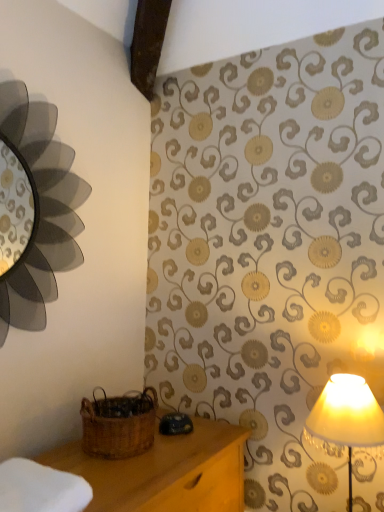
The image size is (384, 512). What do you see at coordinates (41, 488) in the screenshot? I see `white soft cloth at lower left` at bounding box center [41, 488].

The image size is (384, 512). Identify the location of woven brown basket at lower left. (119, 424).

Where is `matte cream lampshade at right`? This screenshot has width=384, height=512. matte cream lampshade at right is located at coordinates (346, 420).

Find the location of a particular element. This screenshot has height=512, width=384. white soft cloth at lower left is located at coordinates (41, 488).

Is white soft cloth at lower left smaller than woven brown basket at lower left?

Yes, white soft cloth at lower left is smaller than woven brown basket at lower left.

Can you see white soft cloth at lower left touching woven brown basket at lower left?

No, white soft cloth at lower left is not touching woven brown basket at lower left.

In the scene shown: From the image's perspective, is white soft cloth at lower left under woven brown basket at lower left?

Correct, white soft cloth at lower left appears lower than woven brown basket at lower left in the image.

Who is more distant, white soft cloth at lower left or matte cream lampshade at right?

matte cream lampshade at right.

Consider the image. Is white soft cloth at lower left oriented away from matte cream lampshade at right?

No, white soft cloth at lower left is not facing the opposite direction of matte cream lampshade at right.

The width and height of the screenshot is (384, 512). I want to click on lamp above the white soft cloth at lower left (from a real-world perspective), so click(x=346, y=420).

Between white soft cloth at lower left and matte cream lampshade at right, which one has larger width?

white soft cloth at lower left is wider.

How different are the orientations of matte cream lampshade at right and white soft cloth at lower left in degrees?

The angle between the facing direction of matte cream lampshade at right and the facing direction of white soft cloth at lower left is 86.9 degrees.

Is matte cream lampshade at right wider than white soft cloth at lower left?

No.

Based on the photo, which is more to the left, matte cream lampshade at right or white soft cloth at lower left?

From the viewer's perspective, white soft cloth at lower left appears more on the left side.

Locate an element on the screen. This screenshot has width=384, height=512. cloth that is above the matte cream lampshade at right (from the image's perspective) is located at coordinates (41, 488).

From the picture: Would you consider woven brown basket at lower left to be distant from white soft cloth at lower left?

No, woven brown basket at lower left is not far from white soft cloth at lower left.

Looking at their sizes, would you say woven brown basket at lower left is wider or thinner than white soft cloth at lower left?

Clearly, woven brown basket at lower left has less width compared to white soft cloth at lower left.

From a real-world perspective, is woven brown basket at lower left beneath white soft cloth at lower left?

No, from a real-world perspective, woven brown basket at lower left is not under white soft cloth at lower left.

Can you tell me how much woven brown basket at lower left and white soft cloth at lower left differ in facing direction?

There is a 2.51-degree angle between the facing directions of woven brown basket at lower left and white soft cloth at lower left.

Are matte cream lampshade at right and woven brown basket at lower left far apart?

No.

From the image's perspective, is matte cream lampshade at right located above or below woven brown basket at lower left?

Clearly, from the image's perspective, matte cream lampshade at right is below woven brown basket at lower left.

Could you tell me if matte cream lampshade at right is turned towards woven brown basket at lower left?

No, matte cream lampshade at right is not oriented towards woven brown basket at lower left.

Considering the sizes of objects matte cream lampshade at right and woven brown basket at lower left in the image provided, who is shorter, matte cream lampshade at right or woven brown basket at lower left?

woven brown basket at lower left is shorter.

Considering the relative sizes of woven brown basket at lower left and matte cream lampshade at right in the image provided, is woven brown basket at lower left bigger than matte cream lampshade at right?

Actually, woven brown basket at lower left might be smaller than matte cream lampshade at right.

Between woven brown basket at lower left and matte cream lampshade at right, which one has larger width?

With larger width is woven brown basket at lower left.

From the image's perspective, relative to matte cream lampshade at right, is woven brown basket at lower left above or below?

woven brown basket at lower left is situated higher than matte cream lampshade at right in the image.

Is woven brown basket at lower left situated inside matte cream lampshade at right or outside?

woven brown basket at lower left exists outside the volume of matte cream lampshade at right.

Where is `basket located on the right of white soft cloth at lower left`? This screenshot has height=512, width=384. basket located on the right of white soft cloth at lower left is located at coordinates (119, 424).

The width and height of the screenshot is (384, 512). In order to click on cloth that appears above the matte cream lampshade at right (from the image's perspective) in this screenshot , I will do `click(41, 488)`.

Estimate the real-world distances between objects in this image. Which object is further from matte cream lampshade at right, white soft cloth at lower left or woven brown basket at lower left?

white soft cloth at lower left.

Estimate the real-world distances between objects in this image. Which object is closer to matte cream lampshade at right, woven brown basket at lower left or white soft cloth at lower left?

woven brown basket at lower left is positioned closer to the anchor matte cream lampshade at right.

Considering their positions, is matte cream lampshade at right positioned closer to white soft cloth at lower left than woven brown basket at lower left?

woven brown basket at lower left is closer to white soft cloth at lower left.

When comparing their distances from white soft cloth at lower left, does woven brown basket at lower left or matte cream lampshade at right seem closer?

Based on the image, woven brown basket at lower left appears to be nearer to white soft cloth at lower left.

Based on their spatial positions, is white soft cloth at lower left or matte cream lampshade at right further from woven brown basket at lower left?

matte cream lampshade at right.

Based on their spatial positions, is matte cream lampshade at right or white soft cloth at lower left closer to woven brown basket at lower left?

The object closer to woven brown basket at lower left is white soft cloth at lower left.

At what (x,y) coordinates should I click in order to perform the action: click on basket located between white soft cloth at lower left and matte cream lampshade at right in the left-right direction. Please return your answer as a coordinate pair (x, y). Image resolution: width=384 pixels, height=512 pixels. Looking at the image, I should click on [119, 424].